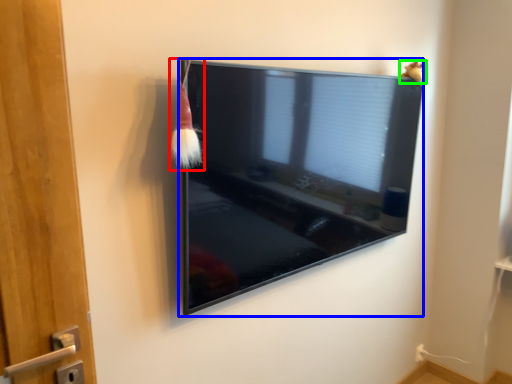
Question: Based on their relative distances, which object is farther from brush (highlighted by a red box)? Choose from television (highlighted by a blue box) and animal (highlighted by a green box).

Choices:
 (A) television
 (B) animal

Answer: (B)